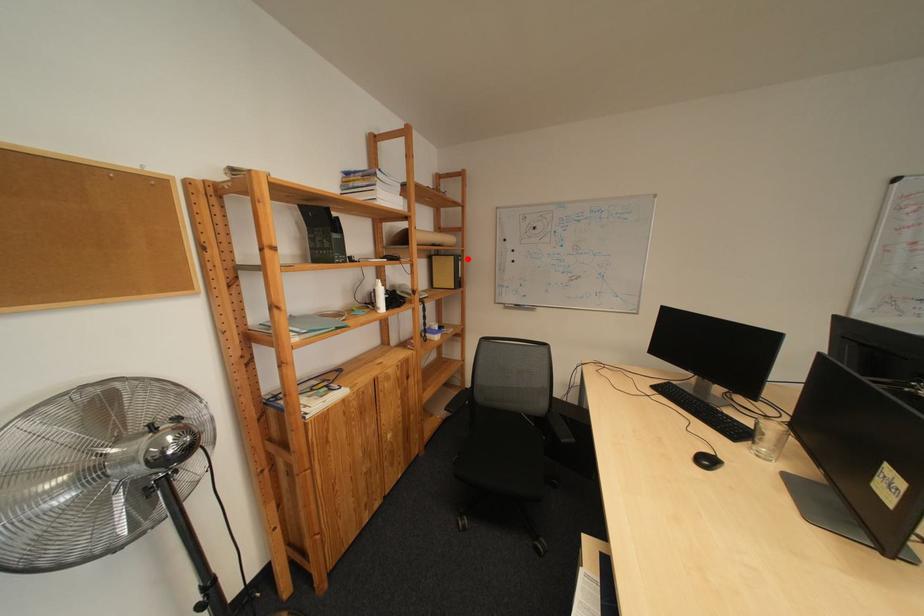
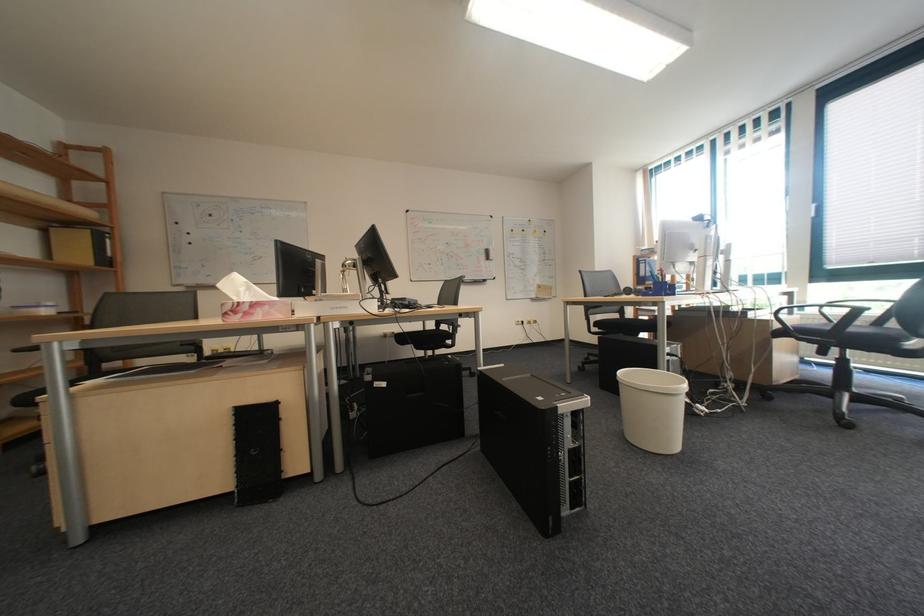
The point at the highlighted location is marked in the first image. Where is the corresponding point in the second image?

(103, 232)